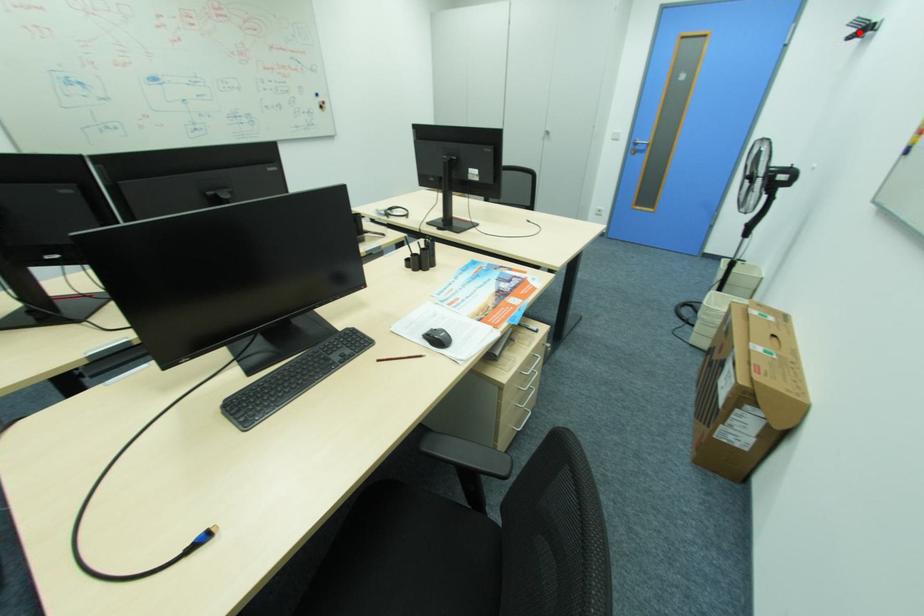
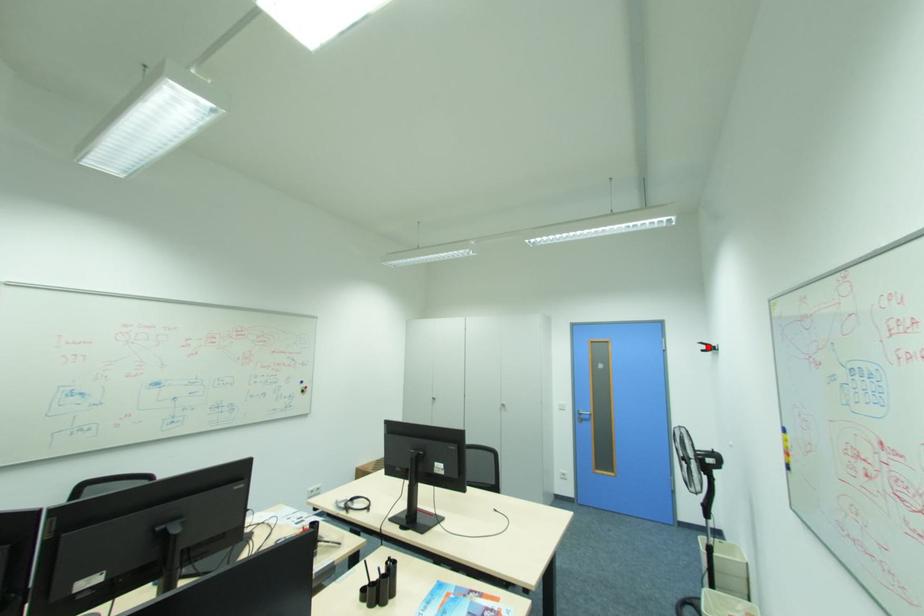
I am providing you with two images of the same scene from different viewpoints. A red point is marked on the first image and another point is marked on the second image. Does the point marked in image1 correspond to the same location as the one in image2?

Yes